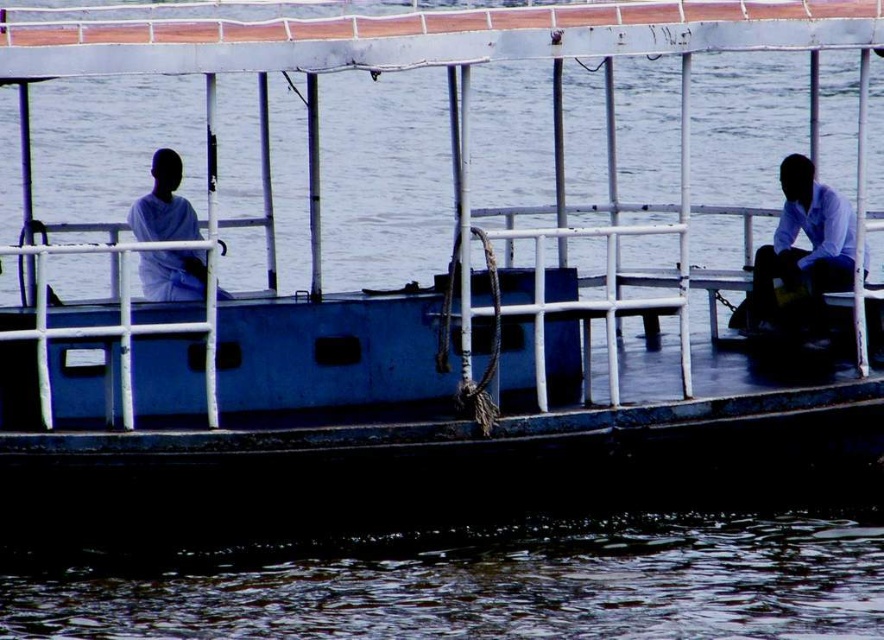
Is point (336, 612) positioned after point (785, 227)?

No.

Is dark water at lower center bigger than white matte shirt at right?

Indeed, dark water at lower center has a larger size compared to white matte shirt at right.

Which is behind, point (402, 620) or point (804, 262)?

Positioned behind is point (804, 262).

Identify the location of dark water at lower center. (477, 584).

Does dark water at lower center have a smaller size compared to white matte shirt at left?

No.

Is dark water at lower center behind white matte shirt at left?

No, dark water at lower center is closer to the viewer.

This screenshot has height=640, width=884. Describe the element at coordinates (477, 584) in the screenshot. I see `dark water at lower center` at that location.

Identify the location of dark water at lower center. This screenshot has width=884, height=640. (477, 584).

Which is behind, point (782, 310) or point (157, 252)?

Point (782, 310)

Between point (785, 316) and point (197, 273), which one is positioned behind?

The point (785, 316) is behind.

Find the location of a particular element. The height and width of the screenshot is (640, 884). white matte shirt at right is located at coordinates (799, 253).